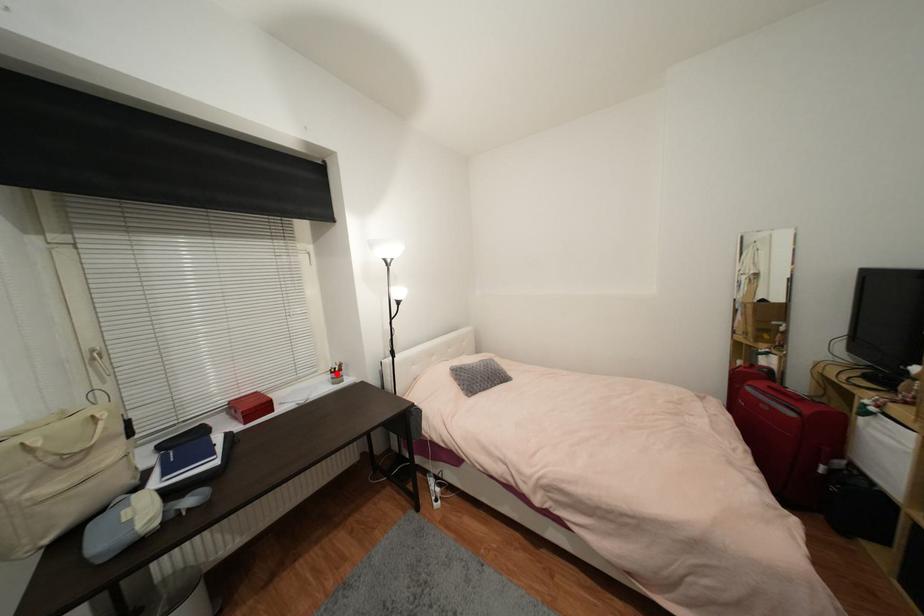
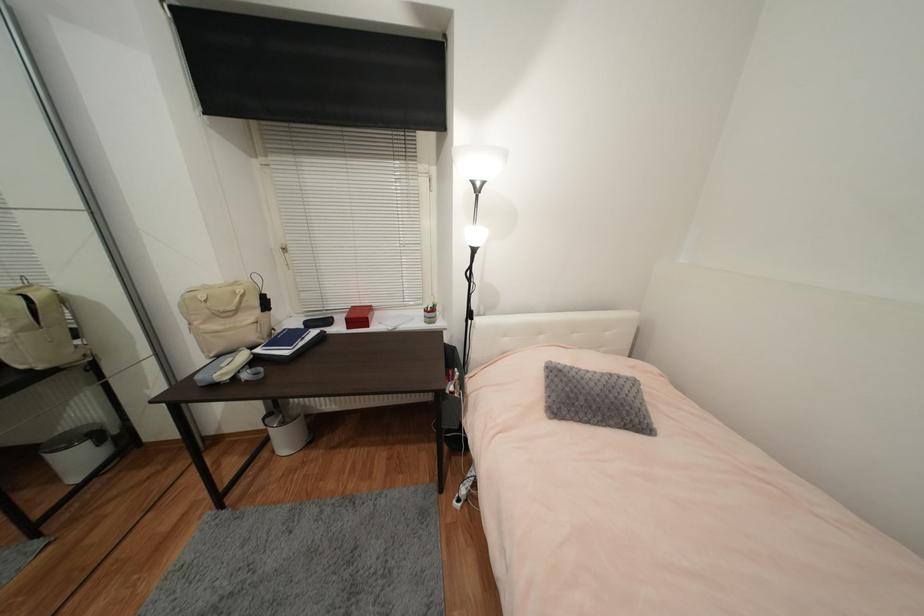
Question: I am providing you with two images of the same scene from different viewpoints. A red point is shown in image1. For the corresponding object point in image2, is it positioned nearer or farther from the camera?

Choices:
 (A) Nearer
 (B) Farther

Answer: (A)